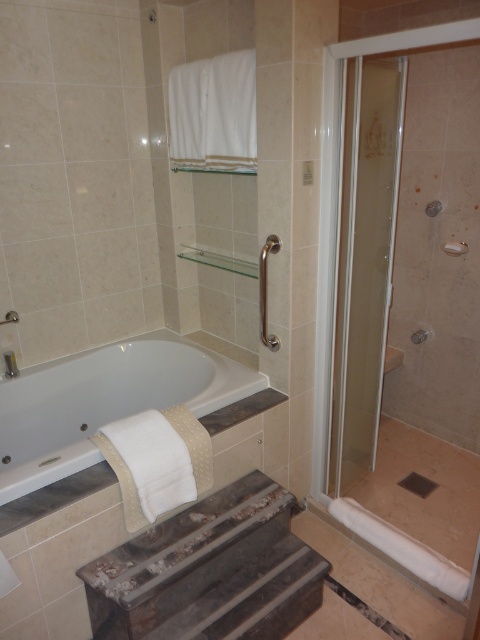
Who is shorter, clear glass shower door at right or white fabric towel at lower left?

white fabric towel at lower left is shorter.

Is clear glass shower door at right wider than white fabric towel at lower left?

Incorrect, clear glass shower door at right's width does not surpass white fabric towel at lower left's.

Between point (350, 458) and point (216, 408), which one is positioned in front?

Point (216, 408)

The image size is (480, 640). Identify the location of clear glass shower door at right. (363, 260).

Between white fabric towel at lower left and silver metallic towel bar at upper right, which one is positioned higher?

Positioned higher is silver metallic towel bar at upper right.

Image resolution: width=480 pixels, height=640 pixels. What do you see at coordinates (105, 401) in the screenshot?
I see `white fabric towel at lower left` at bounding box center [105, 401].

Measure the distance between white fabric towel at lower left and camera.

white fabric towel at lower left and camera are 6.23 feet apart from each other.

At what (x,y) coordinates should I click in order to perform the action: click on white fabric towel at lower left. Please return your answer as a coordinate pair (x, y). The image size is (480, 640). Looking at the image, I should click on (105, 401).

Who is more distant from viewer, (342, 401) or (456, 241)?

Point (456, 241)

Which of these two, clear glass shower door at right or silver metallic towel bar at upper right, stands taller?

With more height is clear glass shower door at right.

Between point (398, 147) and point (451, 244), which one is positioned behind?

Point (451, 244)

Locate an element on the screen. clear glass shower door at right is located at coordinates (363, 260).